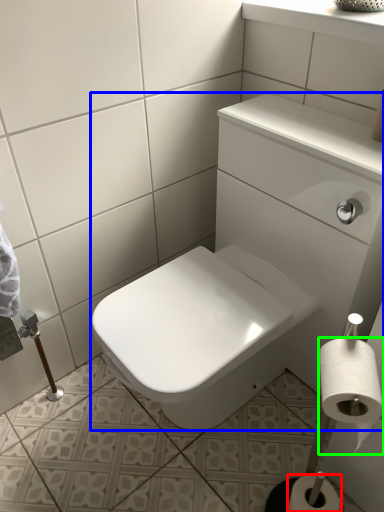
Question: Based on their relative distances, which object is farther from toilet paper (highlighted by a red box)? Choose from sink (highlighted by a blue box) and toilet paper (highlighted by a green box).

Choices:
 (A) sink
 (B) toilet paper

Answer: (A)